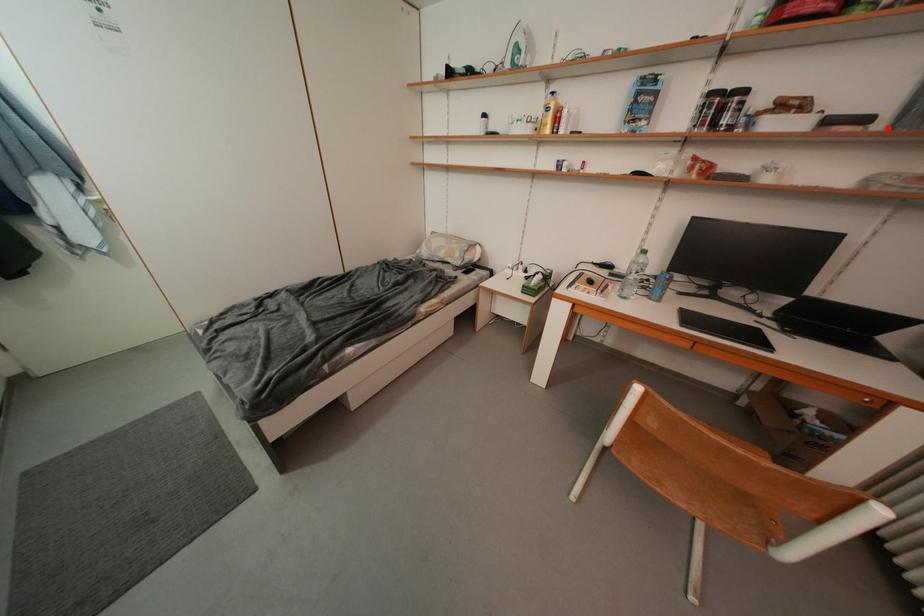
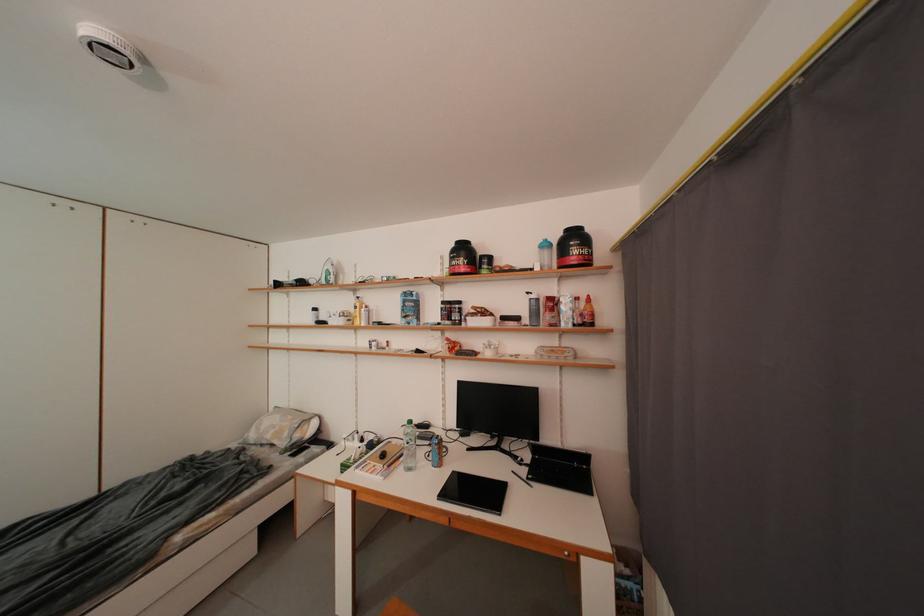
Question: I am providing you with two images of the same scene from different viewpoints. In image1, a red point is highlighted. Considering the same 3D point in image2, which of the following is correct?

Choices:
 (A) It is closer
 (B) It is farther

Answer: (A)